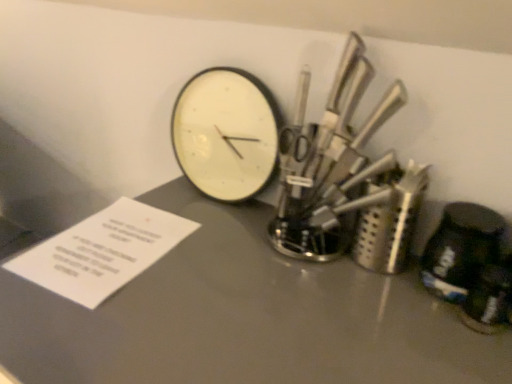
Find the location of `free space underneath white paper at lower left (from a real-world perspective)`. free space underneath white paper at lower left (from a real-world perspective) is located at coordinates (114, 251).